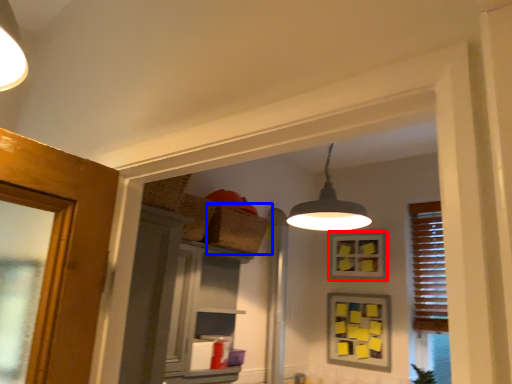
Question: Among these objects, which one is farthest to the camera, picture frame (highlighted by a red box) or basket (highlighted by a blue box)?

Choices:
 (A) picture frame
 (B) basket

Answer: (A)